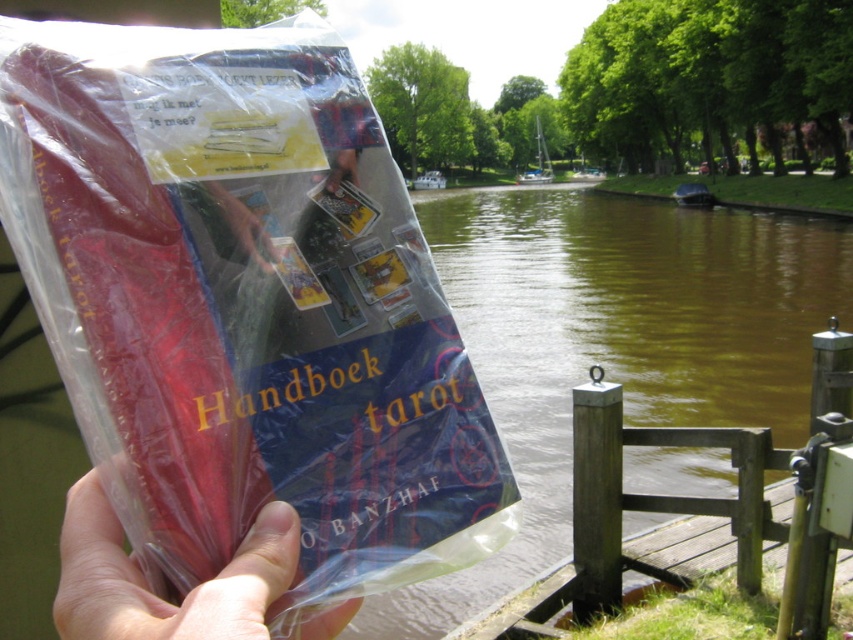
In the scene shown: You are a photographer trying to capture the transparent plastic bag at center and the matte plastic hand at center in a single frame. Based on their sizes in the image, which object would appear larger in your photo?

The transparent plastic bag at center would appear larger in the photo since it has a greater height compared to the matte plastic hand at center.

You are a delivery person who needs to hand over the transparent plastic bag at center to a customer standing 12 inches away from you. Can you safely hand it over without needing to move closer than 12 inches?

The transparent plastic bag at center is 16.51 inches away from the viewer. Since the customer is 12 inches away, you can safely hand it over without needing to move closer than 12 inches.